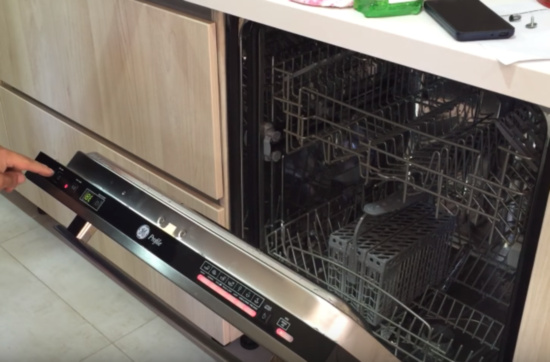
The width and height of the screenshot is (550, 362). In order to click on silverware basket in this screenshot , I will do `click(372, 242)`.